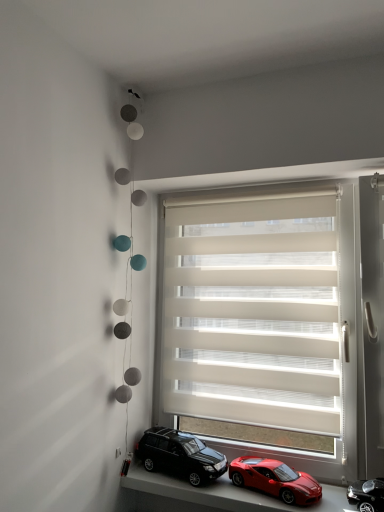
Identify the location of empty space that is ontop of beige fabric window blind at center. (259, 188).